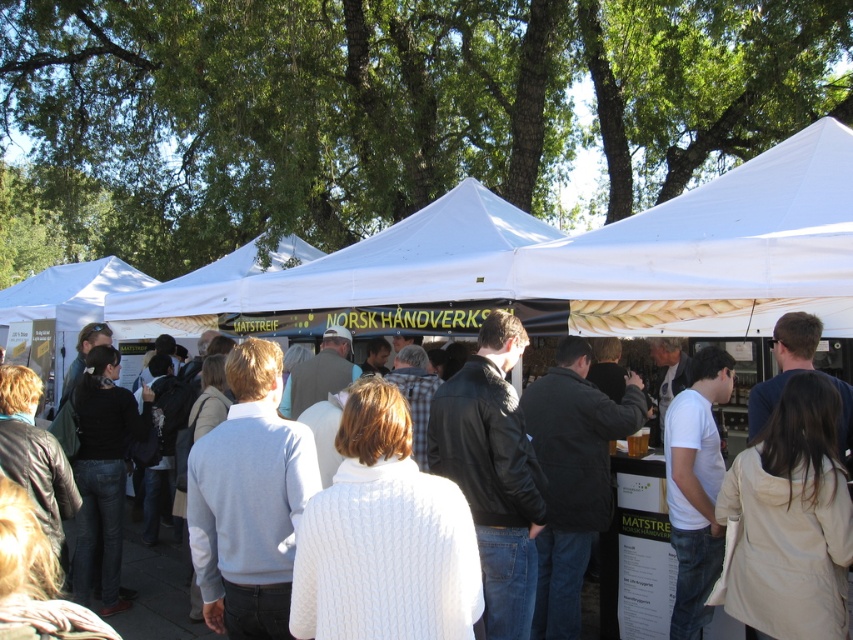
You are a customer at the market and want to find shade to avoid the sun. You see the white fabric canopy at upper center and the white sweater at center. Which object can provide shade for you?

The white fabric canopy at upper center is located above the white sweater at center, so it can provide shade.

You are a photographer at the market and want to capture both the white fabric canopy at upper center and the white sweater at center in a single frame. Can you fit both objects in your camera viewfinder without moving your position?

The white fabric canopy at upper center is wider than the white sweater at center. Since the canopy is wider, it is possible to fit both in the camera viewfinder as long as the camera is positioned to include both the broader canopy and the narrower sweater within the frame.

You are standing in the middle of the outdoor market and want to take a photo that includes both the point at coordinates (x=598, y=259) and the point at (x=123, y=624). Which point should you focus on first to ensure both are in clear view?

You should focus on the point at coordinates (x=598, y=259) first because it is closer to you than the point at (x=123, y=624), ensuring both points remain in clear view.